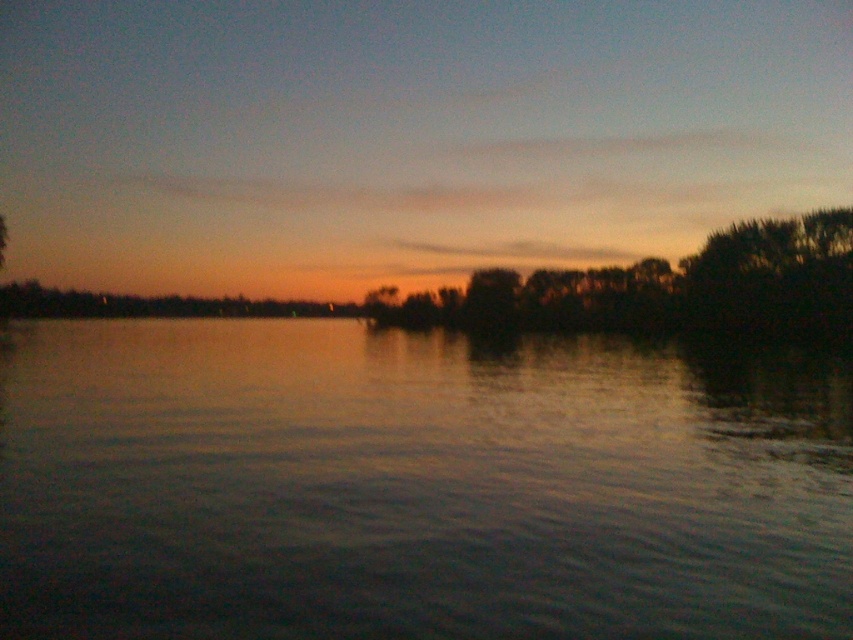
You are standing on a path that runs along the edge of the water. You want to take a photo of the dark green leafy trees at center and the smooth water at center. Which object should you position closer to the edge of the frame to capture both in one shot?

You should position the dark green leafy trees at center closer to the edge of the frame because the smooth water at center is to the left of dark green leafy trees at center, so placing the trees near the edge allows the water to be captured alongside them within the frame.